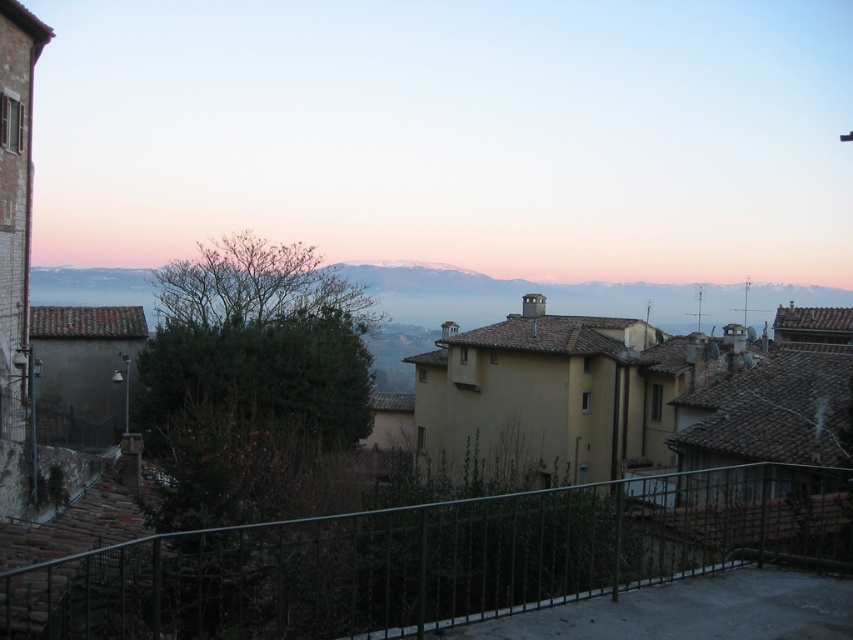
Question: Among these objects, which one is farthest from the camera?

Choices:
 (A) green metal fence at lower center
 (B) snowy mountain at upper center

Answer: (B)

Question: Is green metal fence at lower center wider than snowy mountain at upper center?

Choices:
 (A) no
 (B) yes

Answer: (A)

Question: Considering the relative positions of green metal fence at lower center and snowy mountain at upper center in the image provided, where is green metal fence at lower center located with respect to snowy mountain at upper center?

Choices:
 (A) left
 (B) right

Answer: (A)

Question: In this image, where is green metal fence at lower center located relative to snowy mountain at upper center?

Choices:
 (A) above
 (B) below

Answer: (B)

Question: Which point is farther from the camera taking this photo?

Choices:
 (A) (233, 532)
 (B) (561, 310)

Answer: (B)

Question: Which point is farther from the camera taking this photo?

Choices:
 (A) (392, 376)
 (B) (582, 486)

Answer: (A)